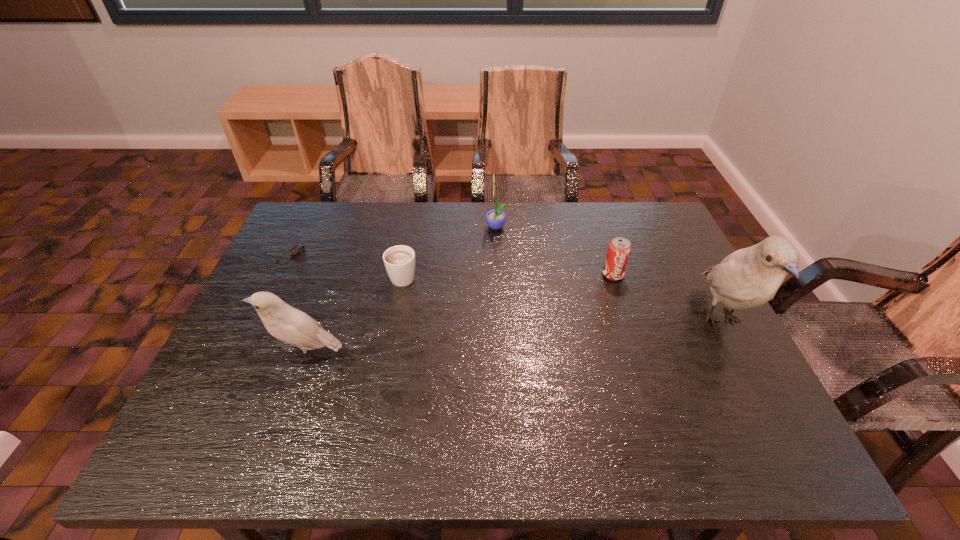
If equal spacing is desired by inserting an extra bird among them, please point out a free spot for this new bird. Please provide its 2D coordinates. Your answer should be formatted as a tuple, i.e. [(x, y)], where the tuple contains the x and y coordinates of a point satisfying the conditions above.

[(521, 336)]